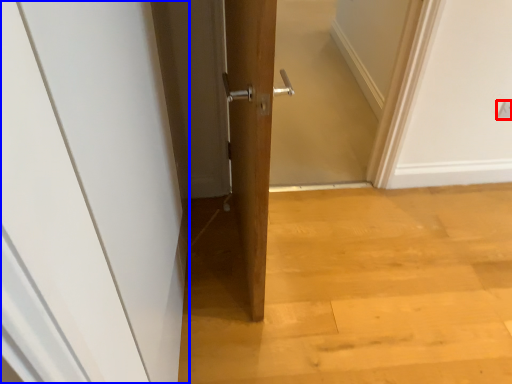
Question: Which object is further to the camera taking this photo, electric outlet (highlighted by a red box) or door (highlighted by a blue box)?

Choices:
 (A) electric outlet
 (B) door

Answer: (A)